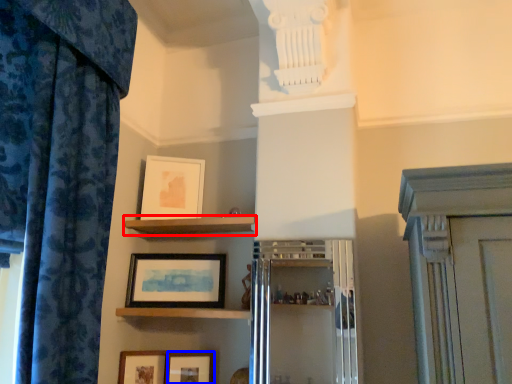
Question: Which point is further to the camera, shelf (highlighted by a red box) or picture frame (highlighted by a blue box)?

Choices:
 (A) shelf
 (B) picture frame

Answer: (B)